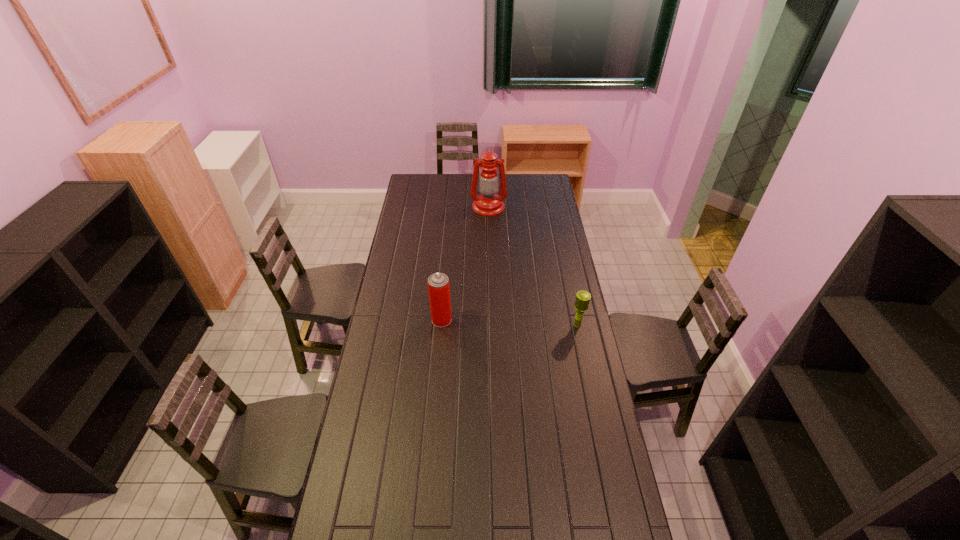
You are a GUI agent. You are given a task and a screenshot of the screen. Output one action in this format:
    pyautogui.click(x=<x>, y=<y>)
    Task: Click on the second object from right to left
    The height and width of the screenshot is (540, 960).
    Given the screenshot: What is the action you would take?
    (488, 203)

The height and width of the screenshot is (540, 960). I want to click on oil lamp, so click(x=488, y=203).

This screenshot has height=540, width=960. Find the location of `the second shortest object`. the second shortest object is located at coordinates (438, 283).

You are a GUI agent. You are given a task and a screenshot of the screen. Output one action in this format:
    pyautogui.click(x=<x>, y=<y>)
    Task: Click on the leftmost object
    The width and height of the screenshot is (960, 540).
    Given the screenshot: What is the action you would take?
    pyautogui.click(x=438, y=283)

At what (x,y) coordinates should I click in order to perform the action: click on microphone. Please return your answer as a coordinate pair (x, y). The image size is (960, 540). Looking at the image, I should click on (582, 300).

Where is `the rightmost object`? The width and height of the screenshot is (960, 540). the rightmost object is located at coordinates (582, 300).

You are a GUI agent. You are given a task and a screenshot of the screen. Output one action in this format:
    pyautogui.click(x=<x>, y=<y>)
    Task: Click on the blank space located 0.180m on the front of the tallest object
    
    Given the screenshot: What is the action you would take?
    pyautogui.click(x=490, y=235)

Find the location of a particular element. The width and height of the screenshot is (960, 540). vacant space positioned on the left of the leftmost object is located at coordinates (398, 320).

At what (x,y) coordinates should I click in order to perform the action: click on free point located 0.180m on the front of the microphone. Please return your answer as a coordinate pair (x, y). Looking at the image, I should click on (586, 364).

At what (x,y) coordinates should I click in order to perform the action: click on object located at the right edge. Please return your answer as a coordinate pair (x, y). This screenshot has width=960, height=540. Looking at the image, I should click on (582, 300).